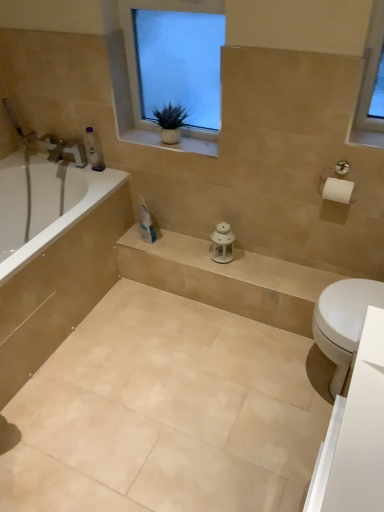
Where is `free space above beige ceramic tile at lower center (from a real-world perspective)`? free space above beige ceramic tile at lower center (from a real-world perspective) is located at coordinates (170, 408).